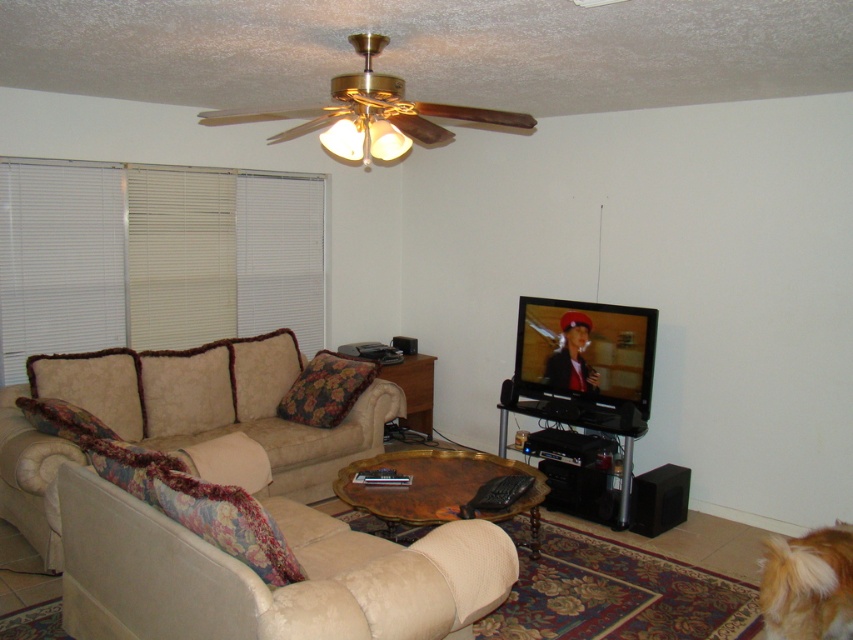
You are standing at the entrance of the living room and want to place a new plant on the beige fabric side table at center. To reach the table, do you need to walk around the beige fabric couch at lower left?

The beige fabric couch at lower left is in front of the beige fabric side table at center, so you need to walk around the beige fabric couch at lower left to reach the table.

You are a guest entering the living room and want to sit down. You see the white fabric blinds at left and the golden fur dog at lower right. Which object is closer to the entrance?

The golden fur dog at lower right is closer to the entrance because it is positioned to the right of the sofa, which is on the left side of the room. Since the entrance is typically located near the sofa area, the dog is closer to the entrance compared to the blinds at the left side of the room.